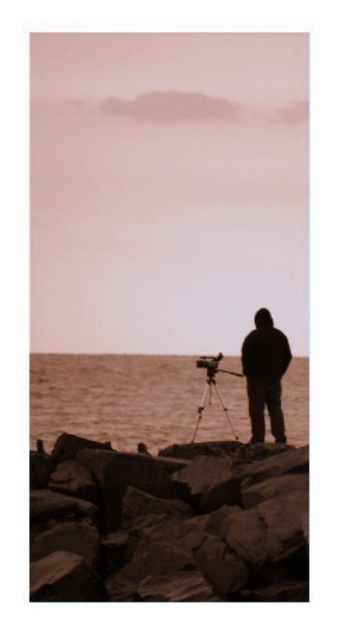
Question: Is rusty stone rocks at lower center above matte black tripod at center?

Choices:
 (A) yes
 (B) no

Answer: (A)

Question: Is rusty stone rocks at lower center wider than black matte jacket at center?

Choices:
 (A) yes
 (B) no

Answer: (A)

Question: Among these points, which one is farthest from the camera?

Choices:
 (A) (275, 424)
 (B) (93, 360)
 (C) (144, 493)
 (D) (212, 365)

Answer: (B)

Question: Is rusty stone rocks at lower center positioned in front of matte black tripod at center?

Choices:
 (A) no
 (B) yes

Answer: (B)

Question: Which of the following is the closest to the observer?

Choices:
 (A) click(88, 426)
 (B) click(253, 394)
 (C) click(209, 365)

Answer: (B)

Question: Which of these objects is positioned closest to the brown water at center?

Choices:
 (A) rusty stone rocks at lower center
 (B) black matte jacket at center
 (C) matte black tripod at center

Answer: (C)